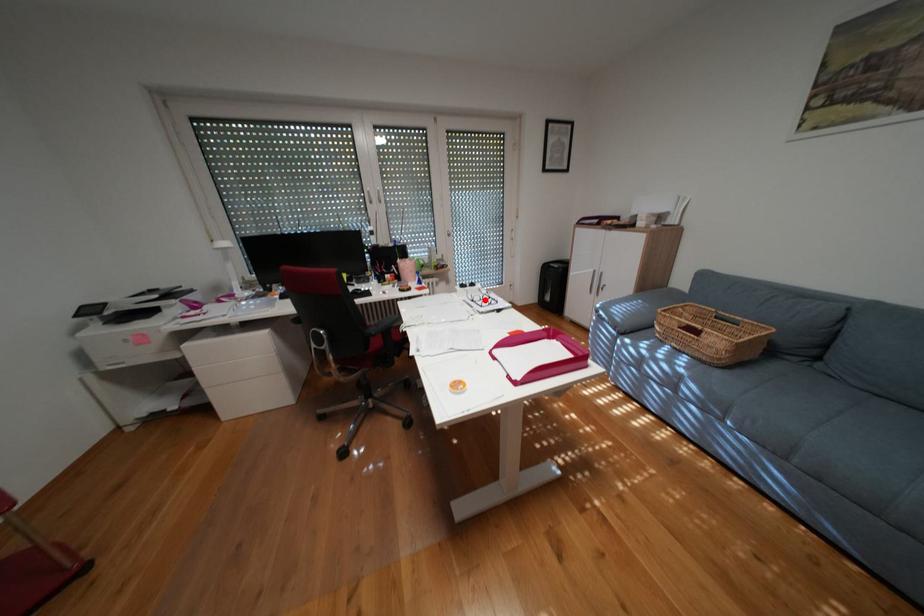
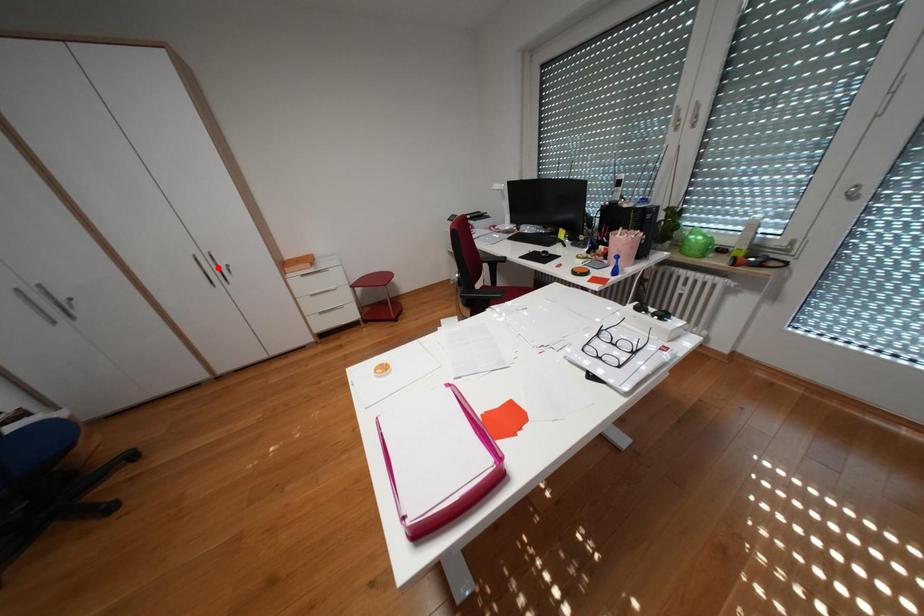
I am providing you with two images of the same scene from different viewpoints. A red point is marked on the first image and another point is marked on the second image. Is the marked point in image1 the same physical position as the marked point in image2?

No